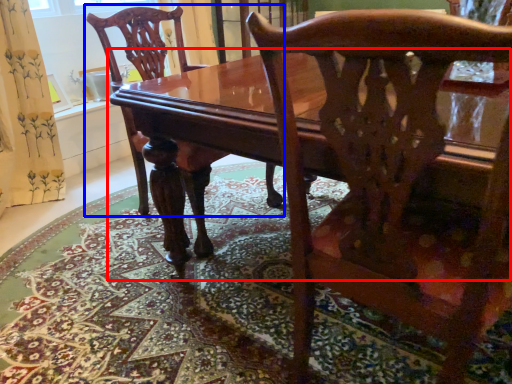
Question: Among these objects, which one is farthest to the camera, table (highlighted by a red box) or chair (highlighted by a blue box)?

Choices:
 (A) table
 (B) chair

Answer: (B)